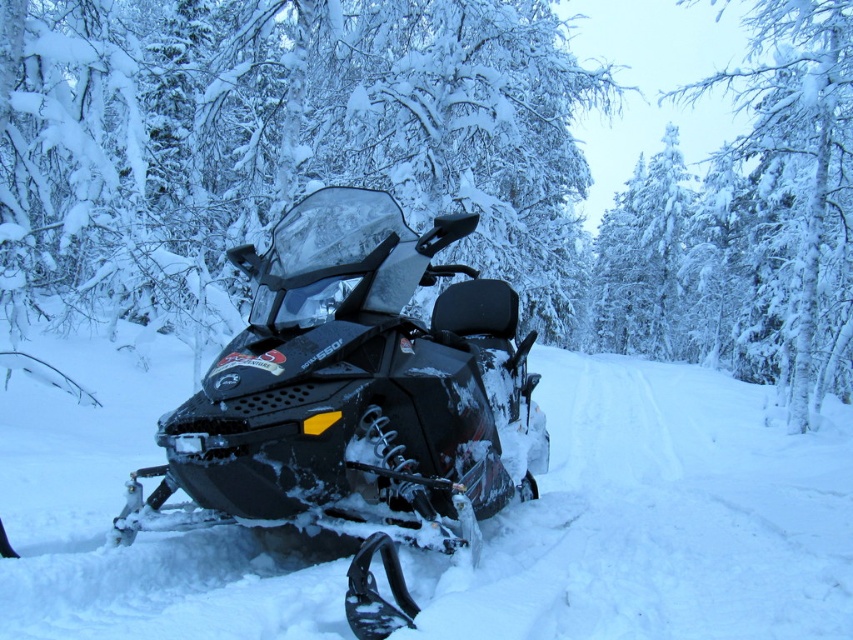
Question: Is snowy branches at center wider than white matte snow at center?

Choices:
 (A) yes
 (B) no

Answer: (A)

Question: Among these points, which one is nearest to the camera?

Choices:
 (A) (555, 147)
 (B) (83, 593)

Answer: (B)

Question: Can you confirm if snowy branches at center is bigger than white matte snow at center?

Choices:
 (A) no
 (B) yes

Answer: (B)

Question: Which of the following is the farthest from the observer?

Choices:
 (A) (683, 557)
 (B) (450, 394)
 (C) (584, 250)

Answer: (C)

Question: Does snowy branches at center have a greater width compared to matte black snowmobile at center?

Choices:
 (A) yes
 (B) no

Answer: (A)

Question: Which point appears closest to the camera in this image?

Choices:
 (A) (611, 237)
 (B) (432, 444)

Answer: (B)